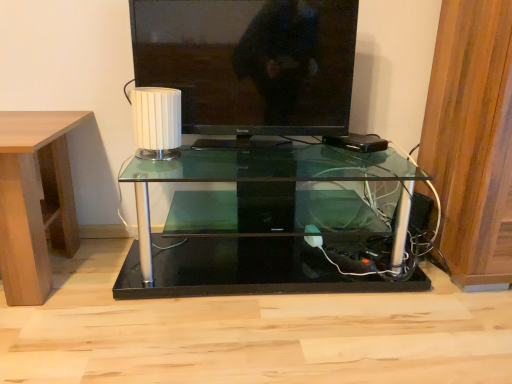
Question: From a real-world perspective, is matte black television at upper center located beneath transparent glass table at center?

Choices:
 (A) yes
 (B) no

Answer: (B)

Question: Is matte black television at upper center oriented away from transparent glass table at center?

Choices:
 (A) yes
 (B) no

Answer: (B)

Question: Is matte black television at upper center surrounding transparent glass table at center?

Choices:
 (A) yes
 (B) no

Answer: (B)

Question: Is matte black television at upper center closer to the viewer compared to transparent glass table at center?

Choices:
 (A) yes
 (B) no

Answer: (B)

Question: Is matte black television at upper center further to the viewer compared to transparent glass table at center?

Choices:
 (A) yes
 (B) no

Answer: (A)

Question: From a real-world perspective, is matte black television at upper center located higher than transparent glass table at center?

Choices:
 (A) no
 (B) yes

Answer: (B)

Question: Is transparent glass table at center completely or partially inside white ribbed lampshade at center?

Choices:
 (A) yes
 (B) no

Answer: (B)

Question: From a real-world perspective, is white ribbed lampshade at center on transparent glass table at center?

Choices:
 (A) no
 (B) yes

Answer: (B)

Question: From the image's perspective, is white ribbed lampshade at center beneath transparent glass table at center?

Choices:
 (A) yes
 (B) no

Answer: (B)

Question: Is white ribbed lampshade at center oriented away from transparent glass table at center?

Choices:
 (A) yes
 (B) no

Answer: (B)

Question: Considering the relative sizes of white ribbed lampshade at center and transparent glass table at center in the image provided, is white ribbed lampshade at center thinner than transparent glass table at center?

Choices:
 (A) yes
 (B) no

Answer: (A)

Question: Is white ribbed lampshade at center positioned behind transparent glass table at center?

Choices:
 (A) no
 (B) yes

Answer: (B)

Question: From the image's perspective, would you say light brown wood at left is shown under white ribbed lampshade at center?

Choices:
 (A) no
 (B) yes

Answer: (B)